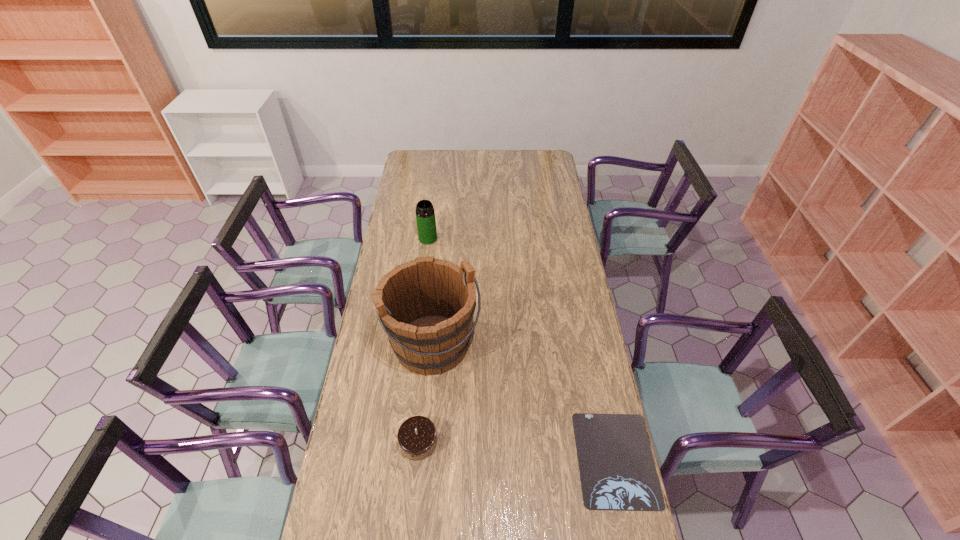
This screenshot has width=960, height=540. Identify the location of chocolate cake. (417, 437).

Identify the location of the rightmost object. The image size is (960, 540). (617, 471).

I want to click on the shortest object, so click(x=617, y=471).

Find the location of a particular element. The height and width of the screenshot is (540, 960). the third shortest object is located at coordinates (425, 215).

At what (x,y) coordinates should I click in order to perform the action: click on thermos bottle. Please return your answer as a coordinate pair (x, y). Image resolution: width=960 pixels, height=540 pixels. Looking at the image, I should click on (425, 215).

Locate an element on the screen. The width and height of the screenshot is (960, 540). wine bucket is located at coordinates (426, 306).

At what (x,y) coordinates should I click in order to perform the action: click on the third nearest object. Please return your answer as a coordinate pair (x, y). The height and width of the screenshot is (540, 960). Looking at the image, I should click on pyautogui.click(x=426, y=306).

The image size is (960, 540). What are the coordinates of `vacant region located on the right of the chocolate cake` in the screenshot? It's located at (529, 442).

Locate an element on the screen. vacant area located on the back of the shortest object is located at coordinates (602, 396).

At what (x,y) coordinates should I click in order to perform the action: click on vacant space located from the spout of the thermos bottle. Please return your answer as a coordinate pair (x, y). The width and height of the screenshot is (960, 540). Looking at the image, I should click on (443, 286).